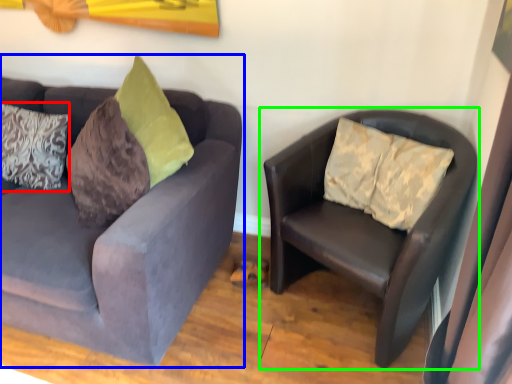
Question: Which object is the farthest from pillow (highlighted by a red box)? Choose among these: studio couch (highlighted by a blue box) or studio couch (highlighted by a green box).

Choices:
 (A) studio couch
 (B) studio couch

Answer: (B)